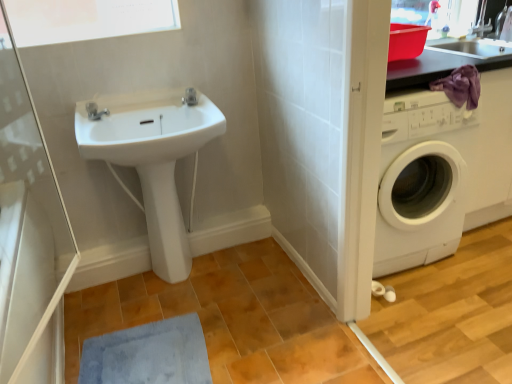
Question: Does white glossy sink at center have a smaller size compared to blue soft bath mat at lower left?

Choices:
 (A) no
 (B) yes

Answer: (A)

Question: From a real-world perspective, is white glossy sink at center physically above blue soft bath mat at lower left?

Choices:
 (A) no
 (B) yes

Answer: (B)

Question: Can you confirm if white glossy sink at center is thinner than blue soft bath mat at lower left?

Choices:
 (A) yes
 (B) no

Answer: (A)

Question: Considering the relative positions of white glossy sink at center and blue soft bath mat at lower left in the image provided, is white glossy sink at center to the left of blue soft bath mat at lower left from the viewer's perspective?

Choices:
 (A) no
 (B) yes

Answer: (A)

Question: Can you confirm if white glossy sink at center is wider than blue soft bath mat at lower left?

Choices:
 (A) no
 (B) yes

Answer: (A)

Question: From a real-world perspective, is white glossy sink at center physically located above or below metallic gray countertop at upper right?

Choices:
 (A) above
 (B) below

Answer: (B)

Question: Choose the correct answer: Is white glossy sink at center inside metallic gray countertop at upper right or outside it?

Choices:
 (A) outside
 (B) inside

Answer: (A)

Question: From the image's perspective, is white glossy sink at center above or below metallic gray countertop at upper right?

Choices:
 (A) below
 (B) above

Answer: (A)

Question: Considering their positions, is white glossy sink at center located in front of or behind metallic gray countertop at upper right?

Choices:
 (A) front
 (B) behind

Answer: (A)

Question: Is white glossy bidet at center spatially inside white glossy sink at center, or outside of it?

Choices:
 (A) outside
 (B) inside

Answer: (A)

Question: Considering the positions of point (173, 266) and point (121, 119), is point (173, 266) closer or farther from the camera than point (121, 119)?

Choices:
 (A) farther
 (B) closer

Answer: (A)

Question: In the image, is white glossy bidet at center on the left side or the right side of white glossy sink at center?

Choices:
 (A) right
 (B) left

Answer: (A)

Question: Considering the positions of white glossy bidet at center and white glossy sink at center in the image, is white glossy bidet at center wider or thinner than white glossy sink at center?

Choices:
 (A) wide
 (B) thin

Answer: (B)

Question: From their relative heights in the image, would you say transparent glass screen door at upper left is taller or shorter than metallic gray countertop at upper right?

Choices:
 (A) tall
 (B) short

Answer: (A)

Question: From a real-world perspective, is transparent glass screen door at upper left above or below metallic gray countertop at upper right?

Choices:
 (A) below
 (B) above

Answer: (B)